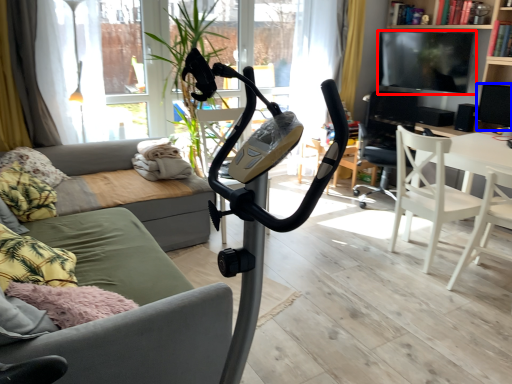
Question: Which point is further to the camera, television (highlighted by a red box) or speaker (highlighted by a blue box)?

Choices:
 (A) television
 (B) speaker

Answer: (A)